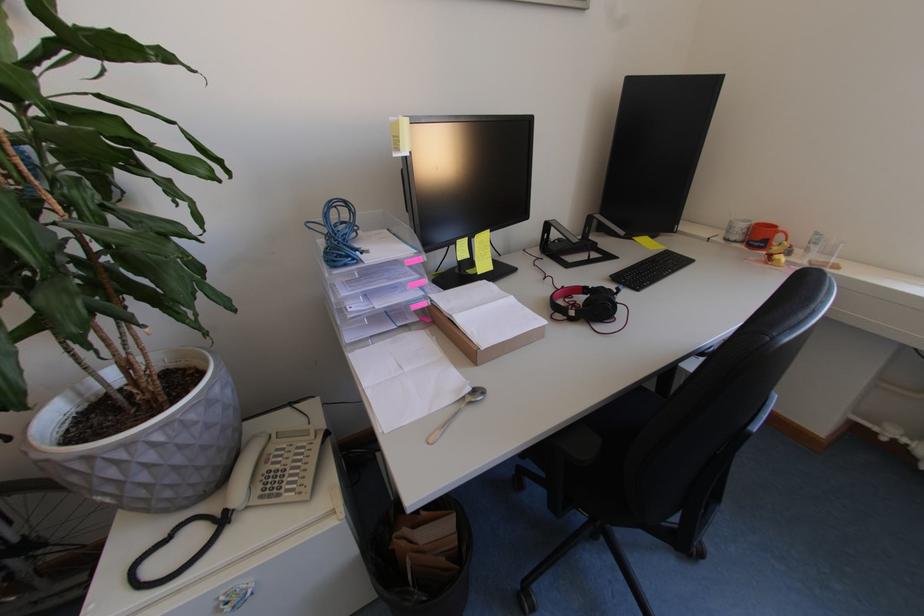
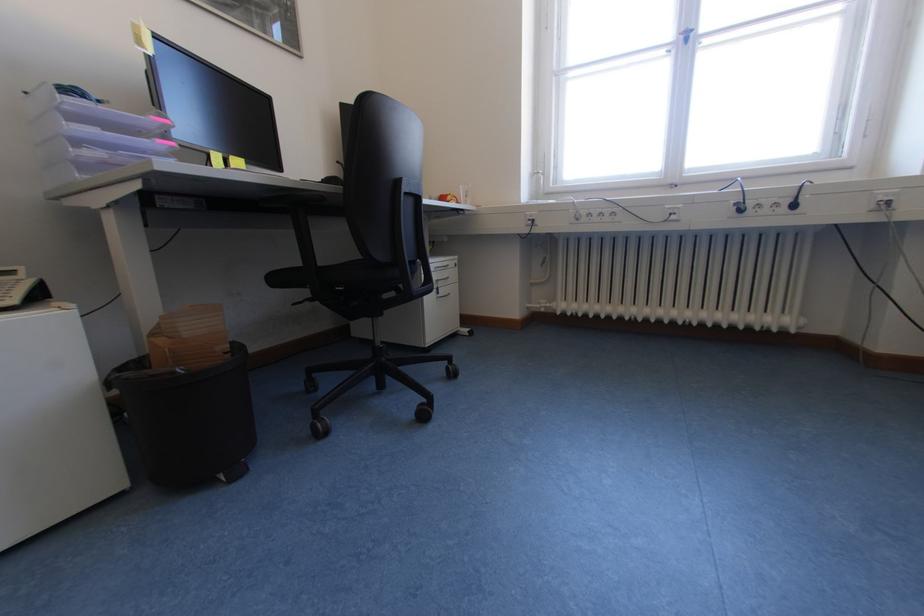
Find the pixel in the second image that matches (x=892, y=440) in the first image.

(551, 310)